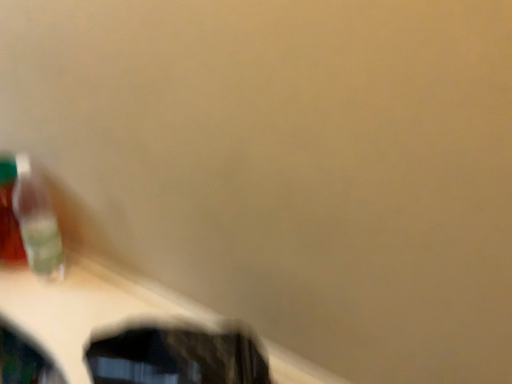
What do you see at coordinates (88, 308) in the screenshot? I see `wooden table at lower left` at bounding box center [88, 308].

Where is `wooden table at lower left`? wooden table at lower left is located at coordinates (x=88, y=308).

The width and height of the screenshot is (512, 384). Describe the element at coordinates (37, 222) in the screenshot. I see `translucent plastic toothbrush at left` at that location.

At what (x,y) coordinates should I click in order to perform the action: click on translucent plastic toothbrush at left. Please return your answer as a coordinate pair (x, y). The width and height of the screenshot is (512, 384). Looking at the image, I should click on (37, 222).

This screenshot has height=384, width=512. In order to click on wooden table at lower left in this screenshot , I will do `click(88, 308)`.

Does translucent plastic toothbrush at left appear on the left side of wooden table at lower left?

Yes, translucent plastic toothbrush at left is to the left of wooden table at lower left.

Relative to wooden table at lower left, is translucent plastic toothbrush at left in front or behind?

Clearly, translucent plastic toothbrush at left is behind wooden table at lower left.

Which is in front, point (32, 243) or point (130, 307)?

The point (130, 307) is closer.

From the image's perspective, is translucent plastic toothbrush at left below wooden table at lower left?

No, from the image's perspective, translucent plastic toothbrush at left is not below wooden table at lower left.

From a real-world perspective, is translucent plastic toothbrush at left over wooden table at lower left?

Indeed, from a real-world perspective, translucent plastic toothbrush at left stands above wooden table at lower left.

Can you confirm if translucent plastic toothbrush at left is wider than wooden table at lower left?

No.

Does translucent plastic toothbrush at left have a lesser height compared to wooden table at lower left?

Incorrect, the height of translucent plastic toothbrush at left does not fall short of that of wooden table at lower left.

Between translucent plastic toothbrush at left and wooden table at lower left, which one has larger size?

Bigger between the two is wooden table at lower left.

Is translucent plastic toothbrush at left outside of wooden table at lower left?

translucent plastic toothbrush at left is positioned outside wooden table at lower left.

Is translucent plastic toothbrush at left far away from wooden table at lower left?

That's not correct — translucent plastic toothbrush at left is a little close to wooden table at lower left.

Is translucent plastic toothbrush at left oriented towards wooden table at lower left?

No.

How many degrees apart are the facing directions of translucent plastic toothbrush at left and wooden table at lower left?

translucent plastic toothbrush at left and wooden table at lower left are facing 0.000422 degrees away from each other.

Where is `toothbrush lying on the left of wooden table at lower left`? The width and height of the screenshot is (512, 384). toothbrush lying on the left of wooden table at lower left is located at coordinates (37, 222).

Would you say wooden table at lower left is to the left or to the right of translucent plastic toothbrush at left in the picture?

wooden table at lower left is to the right of translucent plastic toothbrush at left.

Is wooden table at lower left positioned behind translucent plastic toothbrush at left?

No, wooden table at lower left is closer to the camera.

Does point (34, 341) lie behind point (28, 169)?

No, (34, 341) is in front of (28, 169).

From the image's perspective, is wooden table at lower left on top of translucent plastic toothbrush at left?

No.

From a real-world perspective, who is located lower, wooden table at lower left or translucent plastic toothbrush at left?

wooden table at lower left, from a real-world perspective.

In terms of width, does wooden table at lower left look wider or thinner when compared to translucent plastic toothbrush at left?

Considering their sizes, wooden table at lower left looks broader than translucent plastic toothbrush at left.

Between wooden table at lower left and translucent plastic toothbrush at left, which one has more height?

With more height is translucent plastic toothbrush at left.

Can you confirm if wooden table at lower left is bigger than translucent plastic toothbrush at left?

Indeed, wooden table at lower left has a larger size compared to translucent plastic toothbrush at left.

Is translucent plastic toothbrush at left completely or partially inside wooden table at lower left?

No, translucent plastic toothbrush at left is not surrounded by wooden table at lower left.

Is there a large distance between wooden table at lower left and translucent plastic toothbrush at left?

No, wooden table at lower left is in close proximity to translucent plastic toothbrush at left.

Is translucent plastic toothbrush at left at the back of wooden table at lower left?

No, translucent plastic toothbrush at left is not at the back of wooden table at lower left.

From the picture: How many degrees apart are the facing directions of wooden table at lower left and translucent plastic toothbrush at left?

They differ by 0.000422 degrees in their facing directions.

Locate an element on the screen. This screenshot has height=384, width=512. table located underneath the translucent plastic toothbrush at left (from a real-world perspective) is located at coordinates 88,308.

The width and height of the screenshot is (512, 384). Identify the location of table beneath the translucent plastic toothbrush at left (from a real-world perspective). (88, 308).

Locate an element on the screen. table in front of the translucent plastic toothbrush at left is located at coordinates (88, 308).